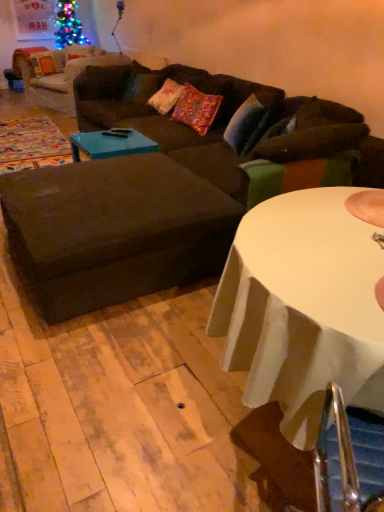
Question: Is dark brown fabric couch at center bigger or smaller than floral fabric pillow at center?

Choices:
 (A) small
 (B) big

Answer: (B)

Question: From the image's perspective, is dark brown fabric couch at center above or below floral fabric pillow at center?

Choices:
 (A) below
 (B) above

Answer: (A)

Question: Estimate the real-world distances between objects in this image. Which object is closer to the dark brown fabric couch at center?

Choices:
 (A) dark brown fabric couch at center
 (B) brown fabric ottoman at center
 (C) blue glossy coffee table at center
 (D) white glossy table at center
 (E) floral fabric pillow at center

Answer: (B)

Question: Considering the real-world distances, which object is closest to the floral fabric pillow at center?

Choices:
 (A) dark brown fabric couch at center
 (B) blue glossy coffee table at center
 (C) white glossy table at center
 (D) brown fabric ottoman at center
 (E) dark brown fabric couch at center

Answer: (E)